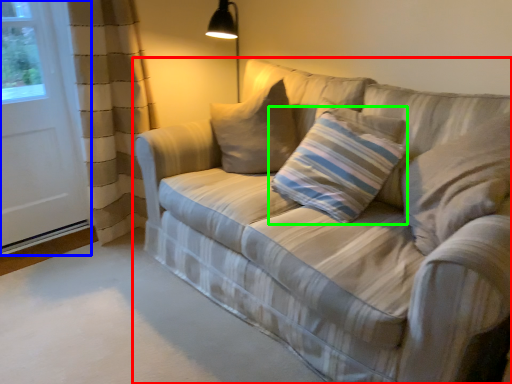
Question: Estimate the real-world distances between objects in this image. Which object is farther from studio couch (highlighted by a red box), screen door (highlighted by a blue box) or pillow (highlighted by a green box)?

Choices:
 (A) screen door
 (B) pillow

Answer: (A)